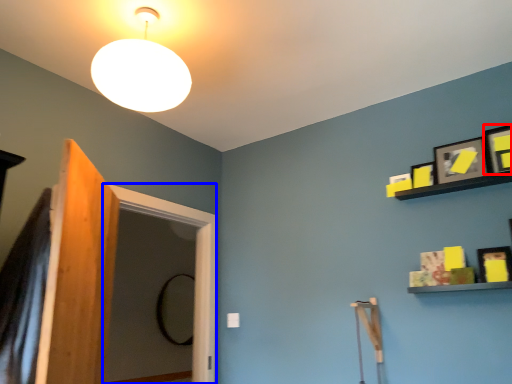
Question: Which of the following is the farthest to the observer, picture frame (highlighted by a red box) or screen door (highlighted by a blue box)?

Choices:
 (A) picture frame
 (B) screen door

Answer: (B)